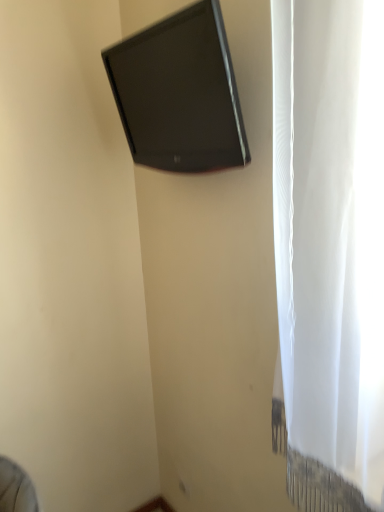
Where is `matte black tv at upper center`? This screenshot has height=512, width=384. matte black tv at upper center is located at coordinates (179, 93).

Image resolution: width=384 pixels, height=512 pixels. What do you see at coordinates (179, 93) in the screenshot?
I see `matte black tv at upper center` at bounding box center [179, 93].

What is the approximate width of matte black tv at upper center?

It is 5.34 inches.

You are a GUI agent. You are given a task and a screenshot of the screen. Output one action in this format:
    pyautogui.click(x=<x>, y=<y>)
    Task: Click on the matte black tv at upper center
    
    Given the screenshot: What is the action you would take?
    pyautogui.click(x=179, y=93)